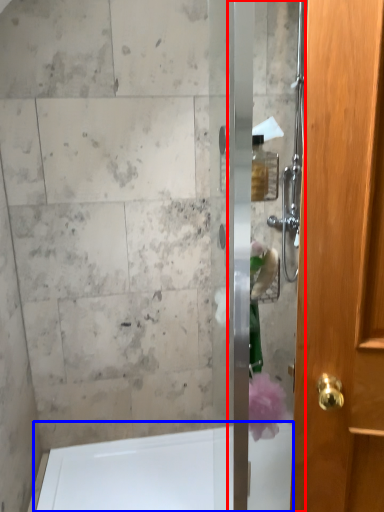
Question: Among these objects, which one is farthest to the camera, screen door (highlighted by a red box) or bath (highlighted by a blue box)?

Choices:
 (A) screen door
 (B) bath

Answer: (B)